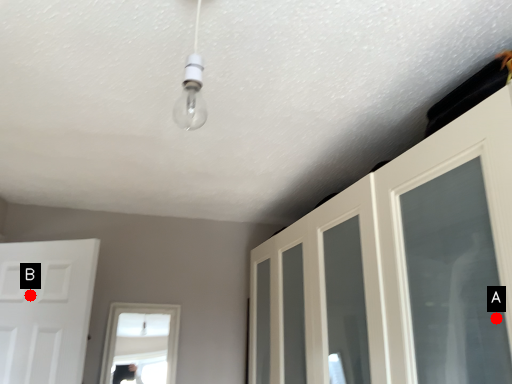
Question: Two points are circled on the image, labeled by A and B beside each circle. Which point is closer to the camera?

Choices:
 (A) A is closer
 (B) B is closer

Answer: (A)